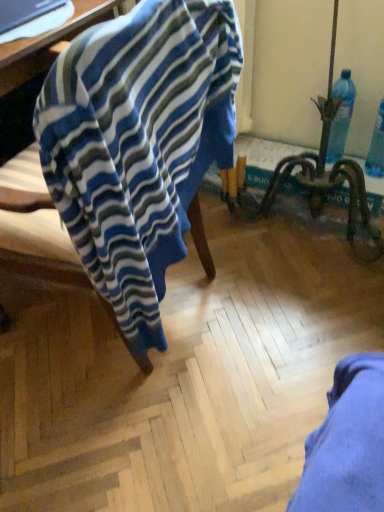
Question: Is matte black laptop at upper left not within blue plastic bottle at upper right?

Choices:
 (A) no
 (B) yes

Answer: (B)

Question: Does matte black laptop at upper left lie behind blue plastic bottle at upper right?

Choices:
 (A) yes
 (B) no

Answer: (B)

Question: Could you tell me if matte black laptop at upper left is facing blue plastic bottle at upper right?

Choices:
 (A) yes
 (B) no

Answer: (B)

Question: Is matte black laptop at upper left positioned with its back to blue plastic bottle at upper right?

Choices:
 (A) yes
 (B) no

Answer: (B)

Question: Are matte black laptop at upper left and blue plastic bottle at upper right far apart?

Choices:
 (A) yes
 (B) no

Answer: (B)

Question: Is matte black laptop at upper left next to blue plastic bottle at upper right and touching it?

Choices:
 (A) no
 (B) yes

Answer: (A)

Question: Is blue striped fabric at left further to camera compared to blue plastic bottle at upper right?

Choices:
 (A) yes
 (B) no

Answer: (B)

Question: From a real-world perspective, is blue striped fabric at left on top of blue plastic bottle at upper right?

Choices:
 (A) no
 (B) yes

Answer: (B)

Question: From the image's perspective, would you say blue striped fabric at left is shown under blue plastic bottle at upper right?

Choices:
 (A) yes
 (B) no

Answer: (A)

Question: Is blue striped fabric at left thinner than blue plastic bottle at upper right?

Choices:
 (A) yes
 (B) no

Answer: (B)

Question: Does blue striped fabric at left turn towards blue plastic bottle at upper right?

Choices:
 (A) yes
 (B) no

Answer: (B)

Question: Is blue striped fabric at left next to blue plastic bottle at upper right?

Choices:
 (A) yes
 (B) no

Answer: (B)

Question: Can you see matte black laptop at upper left touching blue striped fabric at left?

Choices:
 (A) no
 (B) yes

Answer: (A)